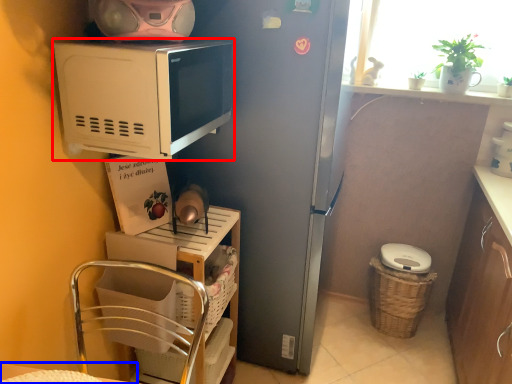
Question: Which object is further to the camera taking this photo, microwave oven (highlighted by a red box) or table (highlighted by a blue box)?

Choices:
 (A) microwave oven
 (B) table

Answer: (A)